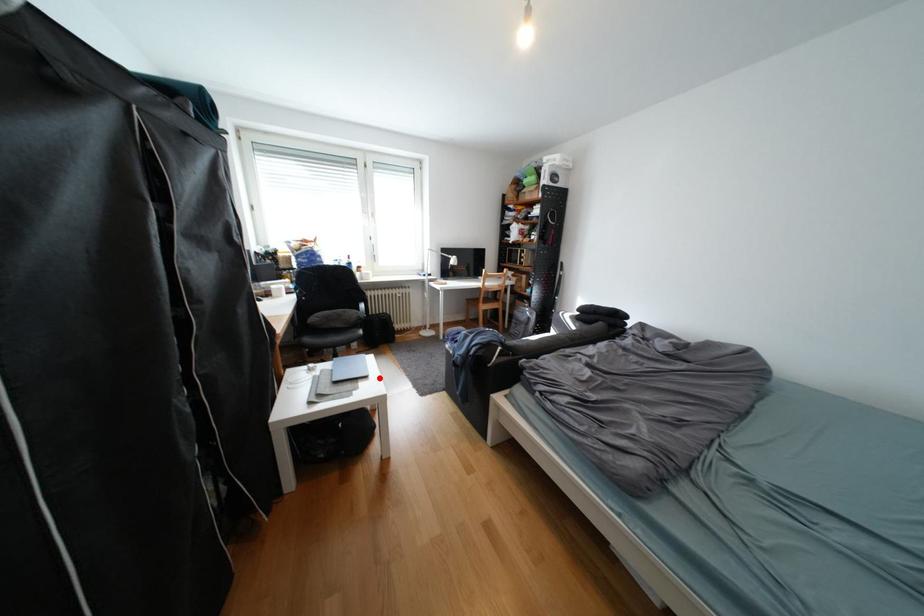
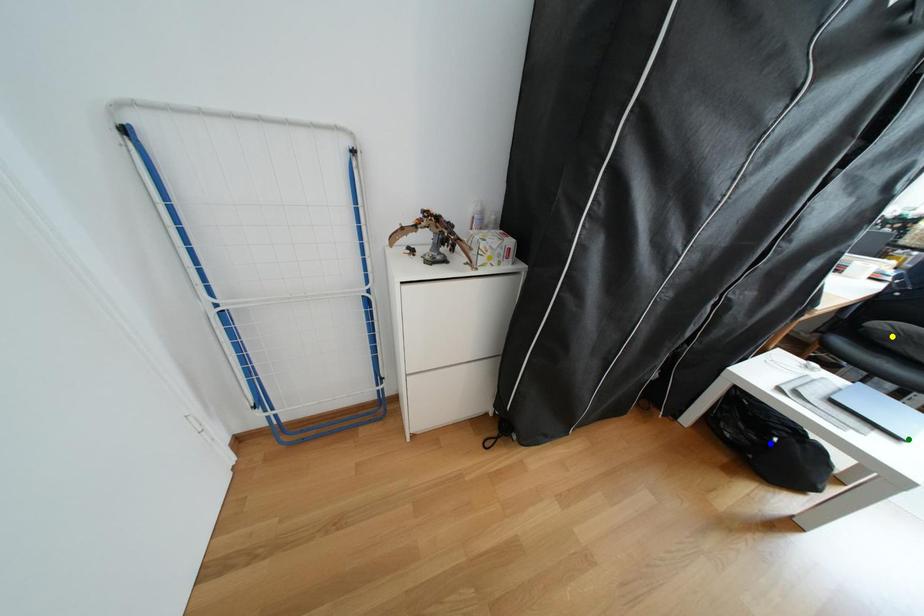
Question: I am providing you with two images of the same scene from different viewpoints. A red point is marked on the first image. You are given multiple points on the second image. Which point in image 2 is actually the same real-world point as the red point in image 1?

Choices:
 (A) yellow point
 (B) green point
 (C) blue point

Answer: (B)